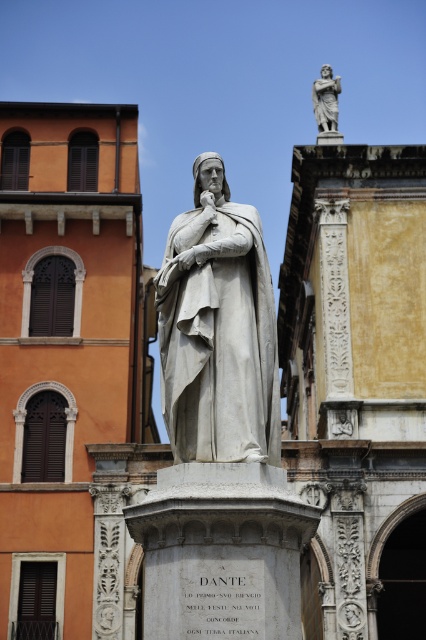
You are a tour guide leading a group to a nearby cafe located 50 meters away from the white marble statue at center. You notice the polished marble statue at upper center in the background. Can your group reach the cafe before the statue becomes completely out of sight?

The white marble statue at center and the polished marble statue at upper center are 52.93 meters apart from each other. Since the cafe is only 50 meters away from the white marble statue at center, the polished marble statue at upper center will be 2.93 meters behind the cafe. Therefore, the statue will still be visible as you approach the cafe, so the group can reach the cafe without the statue becoming completely out of sight.

As a tourist standing in the public square, you want to take a photo of the statue of Dante Alighieri. You notice two points marked on the ground at coordinates point (172, 394) and point (322, 65). Which point should you stand at to ensure the statue is fully visible without any obstructions from the pedestal?

You should stand at point (172, 394) because it is in front of point (322, 65), providing a clearer view of the statue without obstruction from the pedestal.

What is located at the point with coordinates (218, 330) in the image?

The white marble statue at center is located at point (218, 330).